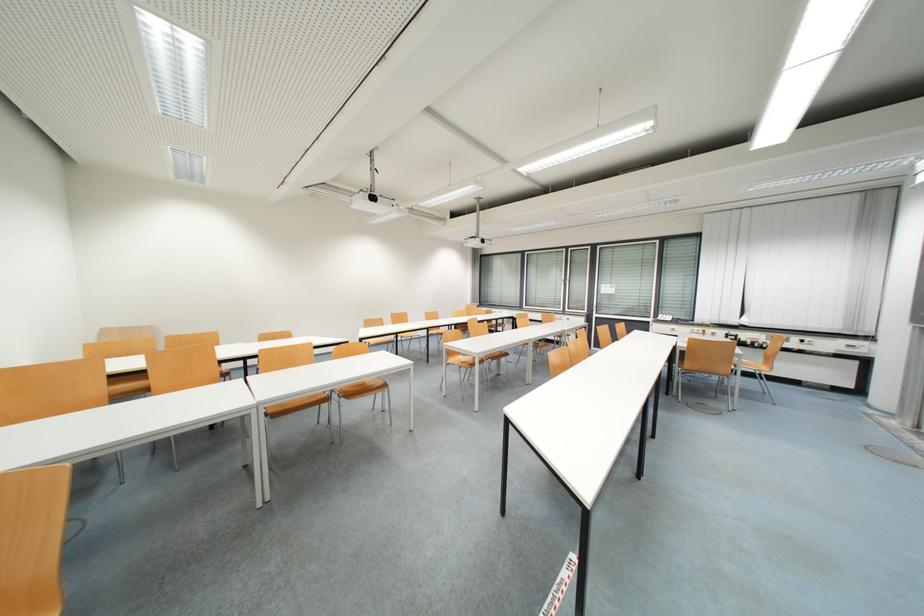
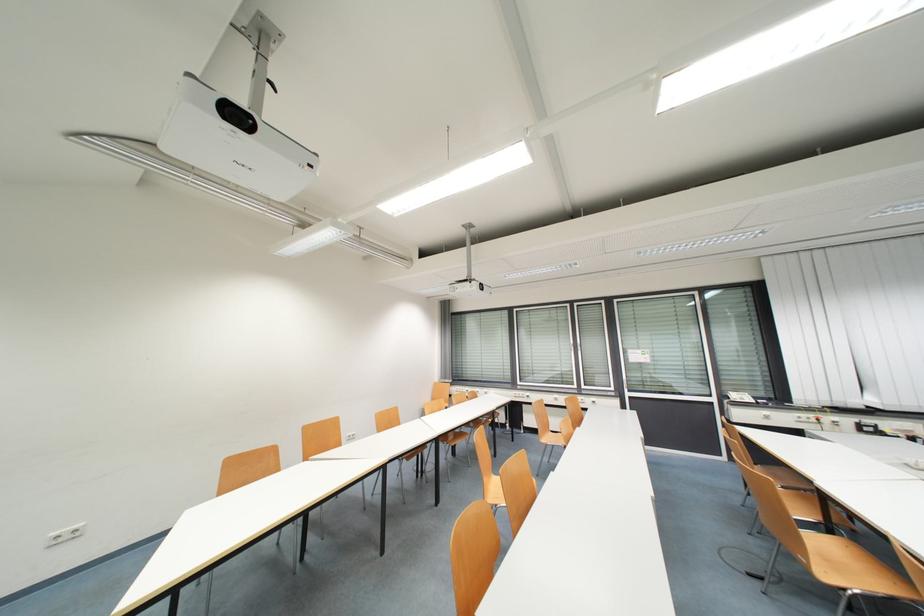
Question: What movement of the cameraman would produce the second image?

Choices:
 (A) Left
 (B) Right
 (C) Forward
 (D) Backward

Answer: (C)